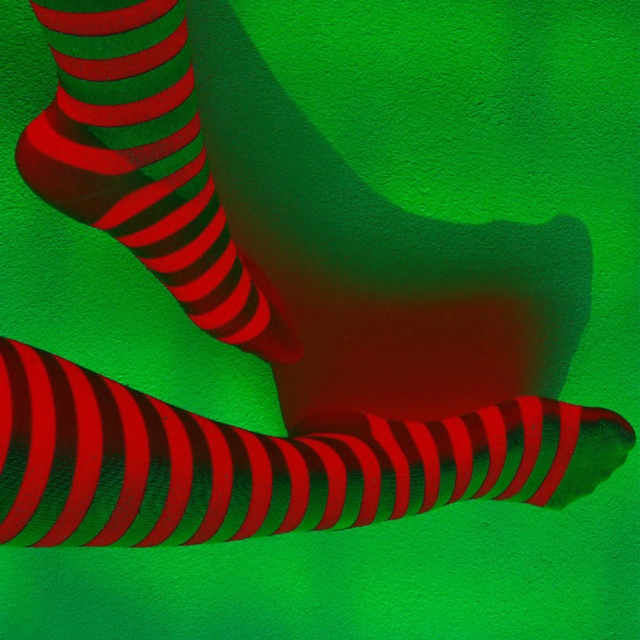
Question: Is shiny metallic sock at lower center wider than shiny metallic socks at upper left?

Choices:
 (A) yes
 (B) no

Answer: (A)

Question: Which point appears farthest from the camera in this image?

Choices:
 (A) (116, 19)
 (B) (568, 461)

Answer: (B)

Question: Can you confirm if shiny metallic sock at lower center is positioned below shiny metallic socks at upper left?

Choices:
 (A) no
 (B) yes

Answer: (B)

Question: Does shiny metallic sock at lower center have a greater width compared to shiny metallic socks at upper left?

Choices:
 (A) yes
 (B) no

Answer: (A)